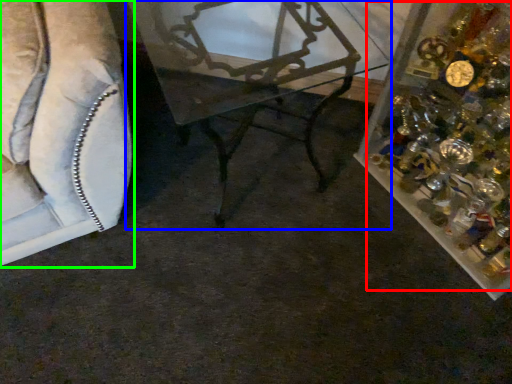
Question: Estimate the real-world distances between objects in this image. Which object is closer to christmas decoration (highlighted by a red box), table (highlighted by a blue box) or furniture (highlighted by a green box)?

Choices:
 (A) table
 (B) furniture

Answer: (A)